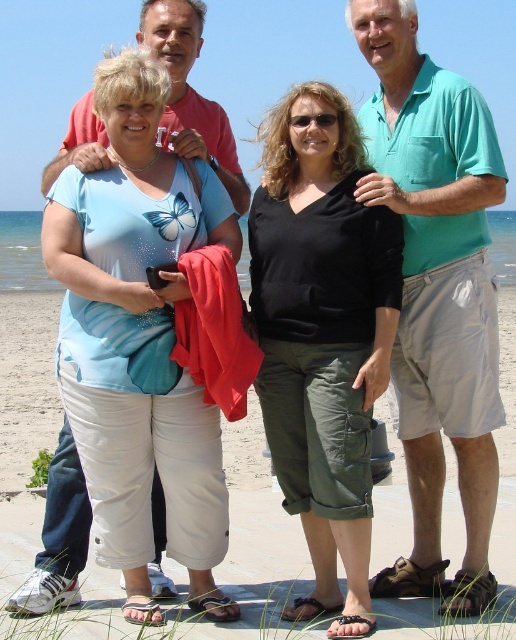
Question: Among these points, which one is nearest to the camera?

Choices:
 (A) (425, 68)
 (B) (341, 404)

Answer: (B)

Question: Is the position of black cotton shirt at center less distant than that of teal cotton shirt at upper right?

Choices:
 (A) yes
 (B) no

Answer: (B)

Question: Does black cotton shirt at center appear over teal cotton shirt at upper right?

Choices:
 (A) yes
 (B) no

Answer: (B)

Question: Is black cotton shirt at center wider than teal cotton shirt at upper right?

Choices:
 (A) no
 (B) yes

Answer: (A)